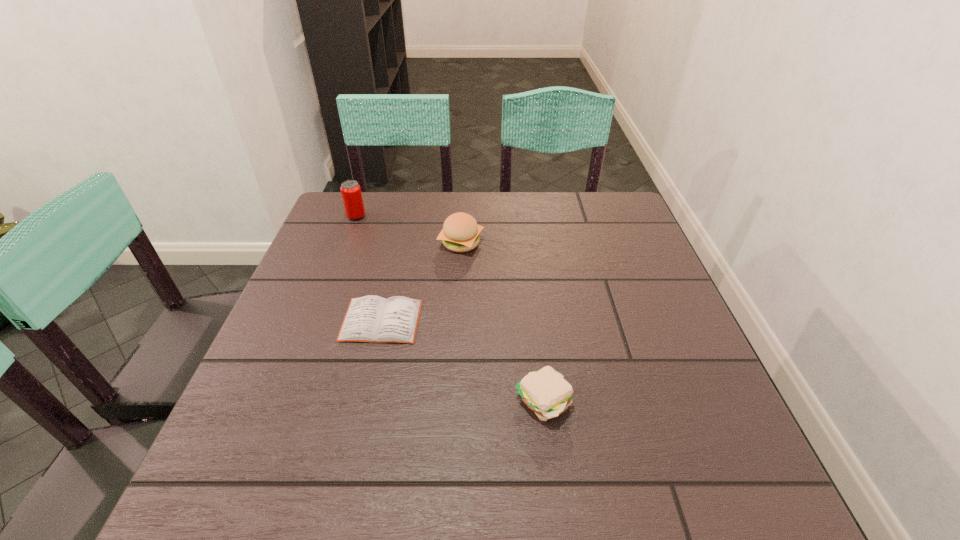
Locate an element on the screen. The width and height of the screenshot is (960, 540). vacant point located between the rightmost object and the farthest object is located at coordinates click(449, 309).

The image size is (960, 540). In order to click on blank region between the hamburger and the tallest object in this screenshot , I will do `click(409, 230)`.

Identify the location of vacant space that is in between the farthest object and the third tallest object. (449, 309).

Locate an element on the screen. free space that is in between the shortest object and the patty is located at coordinates (462, 361).

Locate which object is the closest to the tallest object. Please provide its 2D coordinates. Your answer should be formatted as a tuple, i.e. [(x, y)], where the tuple contains the x and y coordinates of a point satisfying the conditions above.

[(460, 233)]

Find the location of a particular element. the third closest object relative to the leftmost object is located at coordinates pos(546,392).

This screenshot has width=960, height=540. I want to click on free space that satisfies the following two spatial constraints: 1. on the back side of the second nearest object; 2. on the left side of the hamburger, so click(399, 243).

Identify the location of vacant space that satisfies the following two spatial constraints: 1. on the front side of the patty; 2. on the left side of the hamburger. The height and width of the screenshot is (540, 960). (452, 402).